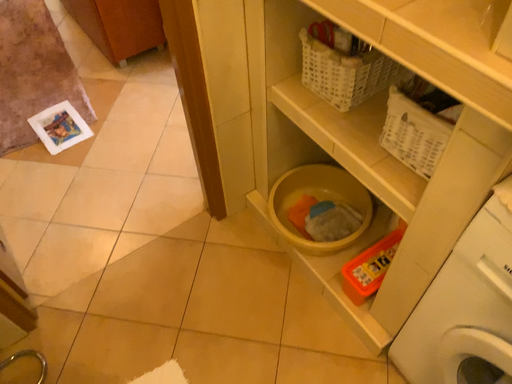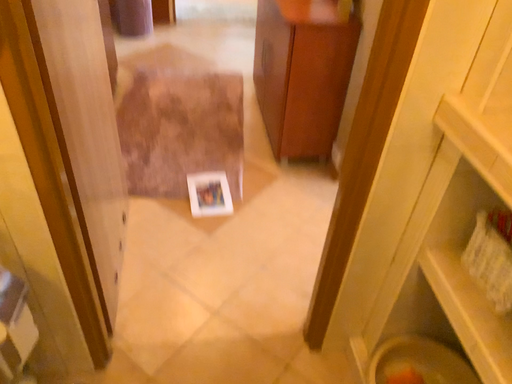
Question: Which way did the camera rotate in the video?

Choices:
 (A) rotated downward
 (B) rotated upward

Answer: (B)